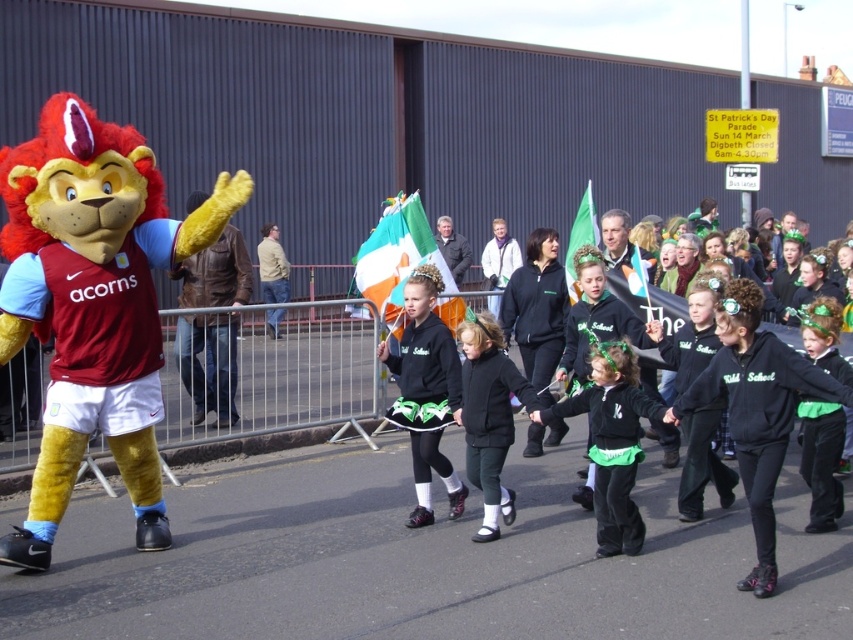
How far apart are velvet plush lion at left and black fabric dress at center?

velvet plush lion at left is 4.66 meters from black fabric dress at center.

Who is lower down, velvet plush lion at left or black fabric dress at center?

black fabric dress at center is below.

Who is more distant from viewer, (61, 476) or (805, 460)?

The point (805, 460) is behind.

Locate an element on the screen. The image size is (853, 640). velvet plush lion at left is located at coordinates (93, 304).

Between black matte skirt at center and light brown leather jacket at center, which one has less height?

With less height is light brown leather jacket at center.

Which of these two, black matte skirt at center or light brown leather jacket at center, stands taller?

Standing taller between the two is black matte skirt at center.

In the scene shown: Who is more distant from viewer, (392, 416) or (271, 316)?

The point (271, 316) is behind.

What are the coordinates of `black matte skirt at center` in the screenshot? It's located at (426, 392).

Is black matte jackets at center positioned before light brown leather jacket at center?

Yes, it is.

Who is taller, black matte jackets at center or light brown leather jacket at center?

light brown leather jacket at center

Does point (618, 285) come behind point (271, 241)?

No, (618, 285) is in front of (271, 241).

Image resolution: width=853 pixels, height=640 pixels. Find the location of `black matte jackets at center`. black matte jackets at center is located at coordinates (759, 390).